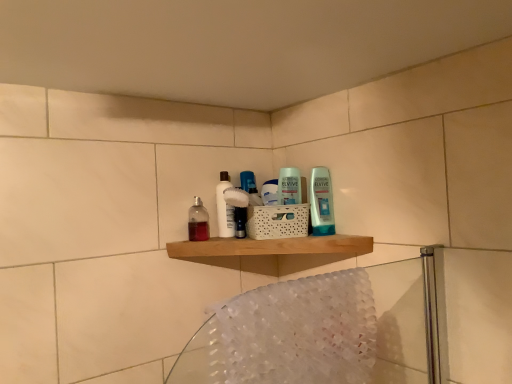
Question: Can you confirm if translucent plastic bottle at center is thinner than white glossy bottle at center?

Choices:
 (A) no
 (B) yes

Answer: (A)

Question: From a real-world perspective, is translucent plastic bottle at center positioned over white glossy bottle at center based on gravity?

Choices:
 (A) yes
 (B) no

Answer: (B)

Question: Is translucent plastic bottle at center to the left of white glossy bottle at center from the viewer's perspective?

Choices:
 (A) yes
 (B) no

Answer: (A)

Question: From the image's perspective, is translucent plastic bottle at center on white glossy bottle at center?

Choices:
 (A) yes
 (B) no

Answer: (B)

Question: Is white glossy bottle at center a part of translucent plastic bottle at center?

Choices:
 (A) yes
 (B) no

Answer: (B)

Question: Is translucent plastic bottle at center in front of white glossy bottle at center?

Choices:
 (A) no
 (B) yes

Answer: (B)

Question: Does translucent fabric bath towel at lower right come behind translucent plastic bottle at center?

Choices:
 (A) no
 (B) yes

Answer: (A)

Question: Does translucent fabric bath towel at lower right have a larger size compared to translucent plastic bottle at center?

Choices:
 (A) no
 (B) yes

Answer: (B)

Question: Is translucent plastic bottle at center surrounded by translucent fabric bath towel at lower right?

Choices:
 (A) yes
 (B) no

Answer: (B)

Question: Can we say translucent fabric bath towel at lower right lies outside translucent plastic bottle at center?

Choices:
 (A) no
 (B) yes

Answer: (B)

Question: Is translucent fabric bath towel at lower right looking in the opposite direction of translucent plastic bottle at center?

Choices:
 (A) yes
 (B) no

Answer: (A)

Question: Does translucent fabric bath towel at lower right appear on the right side of translucent plastic bottle at center?

Choices:
 (A) no
 (B) yes

Answer: (B)

Question: From the image's perspective, does white glossy bottle at center appear lower than translucent plastic bottle at center?

Choices:
 (A) yes
 (B) no

Answer: (B)